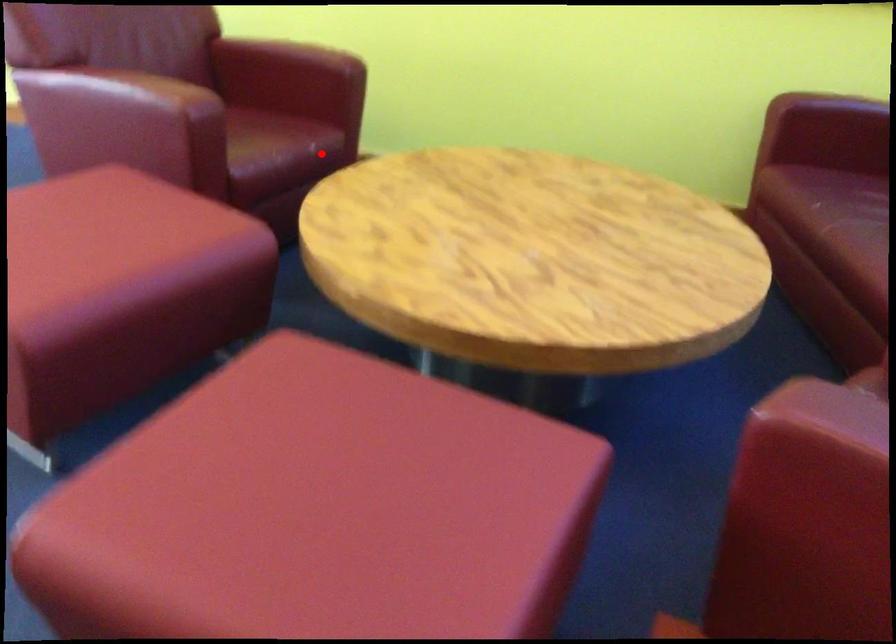
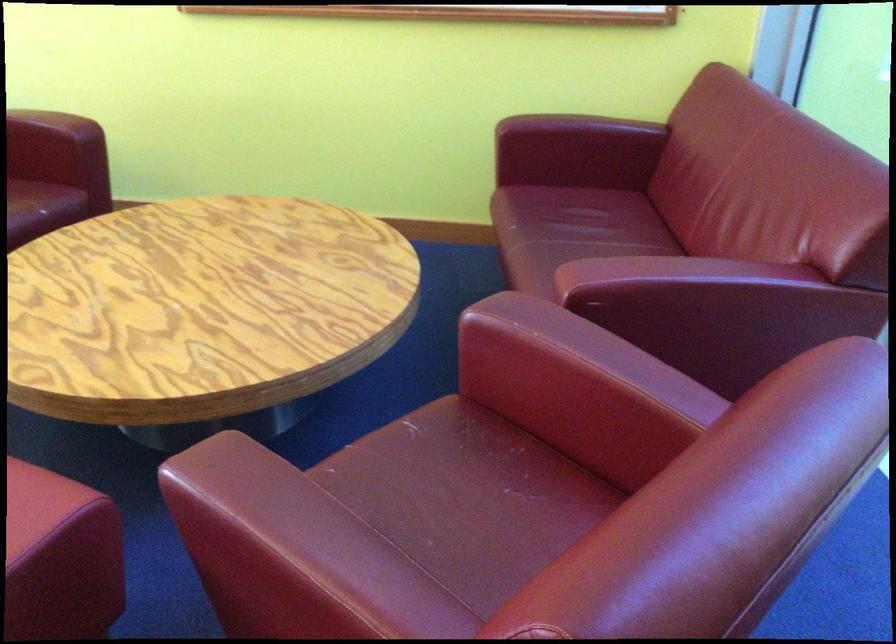
Question: I am providing you with two images of the same scene from different viewpoints. A red point is marked on the first image. Is the red point's position out of view in image 2?

Choices:
 (A) Yes
 (B) No

Answer: (B)